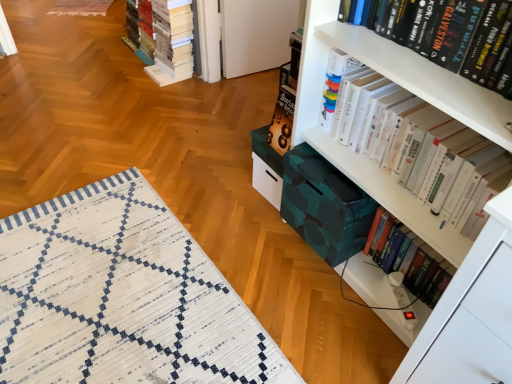
How much space does white paper book at upper left, which is counted as the 4th book, starting from the right, occupy vertically?

The height of white paper book at upper left, which is counted as the 4th book, starting from the right, is 51.81 centimeters.

Image resolution: width=512 pixels, height=384 pixels. Describe the element at coordinates (412, 260) in the screenshot. I see `hardcover book at lower right, which is the third book from front to back` at that location.

What do you see at coordinates (81, 7) in the screenshot? This screenshot has height=384, width=512. I see `rustic woolen quilt at upper left` at bounding box center [81, 7].

Image resolution: width=512 pixels, height=384 pixels. In order to click on hardcover book at upper right, which is the fourth book from back to front in this screenshot , I will do `click(457, 36)`.

Where is `white paper book at upper left, which is counted as the 4th book, starting from the right`? This screenshot has height=384, width=512. white paper book at upper left, which is counted as the 4th book, starting from the right is located at coordinates (168, 39).

Is point (508, 63) positioned before point (408, 280)?

That is True.

Considering the sizes of hardcover book at upper right, the second book viewed from the left, and hardcover book at lower right, placed as the second book when sorted from back to front, in the image, is hardcover book at upper right, the second book viewed from the left, wider or thinner than hardcover book at lower right, placed as the second book when sorted from back to front,?

Considering their sizes, hardcover book at upper right, the second book viewed from the left, looks broader than hardcover book at lower right, placed as the second book when sorted from back to front.

Which object is more forward, hardcover book at upper right, the second book viewed from the left, or hardcover book at lower right, placed as the second book when sorted from back to front?

hardcover book at upper right, the second book viewed from the left, is in front.

From the image's perspective, is hardcover book at upper right, the third book from the right, above or below hardcover book at lower right, which is the third book from front to back?

Clearly, from the image's perspective, hardcover book at upper right, the third book from the right, is above hardcover book at lower right, which is the third book from front to back.

From a real-world perspective, is hardcover book at lower right, placed as the second book when sorted from back to front, located higher than white glossy book at upper right, the 2th book viewed from the right?

No.

Which of these two, hardcover book at lower right, placed as the second book when sorted from back to front, or white glossy book at upper right, positioned as the third book in back-to-front order, is thinner?

hardcover book at lower right, placed as the second book when sorted from back to front, is thinner.

Is hardcover book at lower right, which is the third book from front to back, bigger or smaller than white glossy book at upper right, the 2th book viewed from the right?

In the image, hardcover book at lower right, which is the third book from front to back, appears to be smaller than white glossy book at upper right, the 2th book viewed from the right.

Considering the points (146, 294) and (414, 183), which point is behind, point (146, 294) or point (414, 183)?

Point (146, 294)

Considering the relative sizes of white woven mat at lower left and white glossy book at upper right, the 2th book viewed from the right, in the image provided, is white woven mat at lower left smaller than white glossy book at upper right, the 2th book viewed from the right,?

Incorrect, white woven mat at lower left is not smaller in size than white glossy book at upper right, the 2th book viewed from the right.

From a real-world perspective, is white woven mat at lower left positioned over white glossy book at upper right, acting as the 3th book starting from the left, based on gravity?

No, from a real-world perspective, white woven mat at lower left is not on top of white glossy book at upper right, acting as the 3th book starting from the left.

Considering the sizes of white paper book at upper left, the 1th book positioned from the left, and white glossy book at upper right, acting as the 3th book starting from the left, in the image, is white paper book at upper left, the 1th book positioned from the left, wider or thinner than white glossy book at upper right, acting as the 3th book starting from the left,?

In the image, white paper book at upper left, the 1th book positioned from the left, appears to be wider than white glossy book at upper right, acting as the 3th book starting from the left.

Based on the photo, measure the distance from white paper book at upper left, the 1th book positioned from the left, to white glossy book at upper right, acting as the 3th book starting from the left.

white paper book at upper left, the 1th book positioned from the left, is 1.60 meters away from white glossy book at upper right, acting as the 3th book starting from the left.

Based on their sizes in the image, would you say white paper book at upper left, the 1th book positioned from the left, is bigger or smaller than white glossy book at upper right, which is counted as the second book, starting from the front?

In the image, white paper book at upper left, the 1th book positioned from the left, appears to be larger than white glossy book at upper right, which is counted as the second book, starting from the front.

Is there a large distance between white paper book at upper left, the 1th book positioned from the left, and white glossy book at upper right, which is counted as the second book, starting from the front?

white paper book at upper left, the 1th book positioned from the left, is positioned a significant distance from white glossy book at upper right, which is counted as the second book, starting from the front.

Is rustic woolen quilt at upper left oriented away from white paper book at upper left, placed as the 1th book when sorted from back to front?

No, rustic woolen quilt at upper left is not facing the opposite direction of white paper book at upper left, placed as the 1th book when sorted from back to front.

Is rustic woolen quilt at upper left far from white paper book at upper left, which is counted as the 4th book, starting from the right?

Yes, rustic woolen quilt at upper left and white paper book at upper left, which is counted as the 4th book, starting from the right, are located far from each other.

Considering the positions of objects rustic woolen quilt at upper left and white paper book at upper left, placed as the 1th book when sorted from back to front, in the image provided, who is in front, rustic woolen quilt at upper left or white paper book at upper left, placed as the 1th book when sorted from back to front,?

white paper book at upper left, placed as the 1th book when sorted from back to front, is in front.

Looking at the image, does white woven mat at lower left seem bigger or smaller compared to hardcover book at upper right, the second book viewed from the left?

Considering their sizes, white woven mat at lower left takes up more space than hardcover book at upper right, the second book viewed from the left.

Between white woven mat at lower left and hardcover book at upper right, which is the fourth book from back to front, which one has less height?

With less height is white woven mat at lower left.

Consider the image. What's the angular difference between white woven mat at lower left and hardcover book at upper right, the third book from the right,'s facing directions?

The angle between the facing direction of white woven mat at lower left and the facing direction of hardcover book at upper right, the third book from the right, is 178 degrees.

Which is behind, white glossy book at upper right, positioned as the third book in back-to-front order, or hardcover book at upper right, which is the fourth book from back to front?

Positioned behind is white glossy book at upper right, positioned as the third book in back-to-front order.

Is white glossy book at upper right, positioned as the third book in back-to-front order, to the left or to the right of hardcover book at upper right, the third book from the right, in the image?

From the image, it's evident that white glossy book at upper right, positioned as the third book in back-to-front order, is to the right of hardcover book at upper right, the third book from the right.

From the picture: Could you tell me if white glossy book at upper right, which is counted as the second book, starting from the front, is facing hardcover book at upper right, the third book from the right?

No, white glossy book at upper right, which is counted as the second book, starting from the front, does not turn towards hardcover book at upper right, the third book from the right.

Considering the relative sizes of white glossy book at upper right, which is counted as the second book, starting from the front, and hardcover book at upper right, the second book viewed from the left, in the image provided, is white glossy book at upper right, which is counted as the second book, starting from the front, smaller than hardcover book at upper right, the second book viewed from the left,?

No.

From a real-world perspective, count 3rd books upward from the hardcover book at lower right, arranged as the 4th book when viewed from the left, and point to it. Please provide its 2D coordinates.

[(457, 36)]

At what (x,y) coordinates should I click in order to perform the action: click on the 1st book above when counting from the hardcover book at lower right, acting as the 1th book starting from the right (from the image's perspective). Please return your answer as a coordinate pair (x, y). This screenshot has width=512, height=384. Looking at the image, I should click on tap(416, 154).

When comparing their distances from white glossy book at upper right, acting as the 3th book starting from the left, does white paper book at upper left, the 1th book positioned from the left, or rustic woolen quilt at upper left seem further?

Among the two, rustic woolen quilt at upper left is located further to white glossy book at upper right, acting as the 3th book starting from the left.

Estimate the real-world distances between objects in this image. Which object is further from white glossy book at upper right, the 2th book viewed from the right, hardcover book at upper right, the third book from the right, or rustic woolen quilt at upper left?

The object further to white glossy book at upper right, the 2th book viewed from the right, is rustic woolen quilt at upper left.

From the image, which object appears to be nearer to white paper book at upper left, placed as the 1th book when sorted from back to front, white glossy book at upper right, acting as the 3th book starting from the left, or hardcover book at lower right, acting as the 1th book starting from the right?

white glossy book at upper right, acting as the 3th book starting from the left.

From the image, which object appears to be nearer to hardcover book at lower right, placed as the second book when sorted from back to front, hardcover book at upper right, which is the fourth book from back to front, or white glossy book at upper right, which is counted as the second book, starting from the front?

white glossy book at upper right, which is counted as the second book, starting from the front, is positioned closer to the anchor hardcover book at lower right, placed as the second book when sorted from back to front.

When comparing their distances from hardcover book at lower right, placed as the second book when sorted from back to front, does white paper book at upper left, placed as the 1th book when sorted from back to front, or white woven mat at lower left seem further?

white paper book at upper left, placed as the 1th book when sorted from back to front, is positioned further to the anchor hardcover book at lower right, placed as the second book when sorted from back to front.

Looking at the image, which one is located closer to hardcover book at lower right, which is the third book from front to back, white woven mat at lower left or rustic woolen quilt at upper left?

white woven mat at lower left is closer to hardcover book at lower right, which is the third book from front to back.

Based on their spatial positions, is hardcover book at upper right, the third book from the right, or rustic woolen quilt at upper left closer to white paper book at upper left, which is counted as the 4th book, starting from the right?

The object closer to white paper book at upper left, which is counted as the 4th book, starting from the right, is rustic woolen quilt at upper left.

Based on the photo, looking at the image, which one is located closer to white glossy book at upper right, positioned as the third book in back-to-front order, hardcover book at lower right, placed as the second book when sorted from back to front, or white woven mat at lower left?

hardcover book at lower right, placed as the second book when sorted from back to front.

The width and height of the screenshot is (512, 384). Identify the location of book located between hardcover book at lower right, placed as the second book when sorted from back to front, and rustic woolen quilt at upper left in the depth direction. (168, 39).

Find the location of a particular element. The image size is (512, 384). mat positioned between hardcover book at upper right, the first book viewed from the front, and white paper book at upper left, the 4th book when ordered from front to back, from near to far is located at coordinates (122, 297).

Identify the location of book between hardcover book at upper right, the second book viewed from the left, and hardcover book at lower right, which is the third book from front to back, in the vertical direction. (416, 154).

The width and height of the screenshot is (512, 384). I want to click on mat between white glossy book at upper right, acting as the 3th book starting from the left, and rustic woolen quilt at upper left in the front-back direction, so click(x=122, y=297).